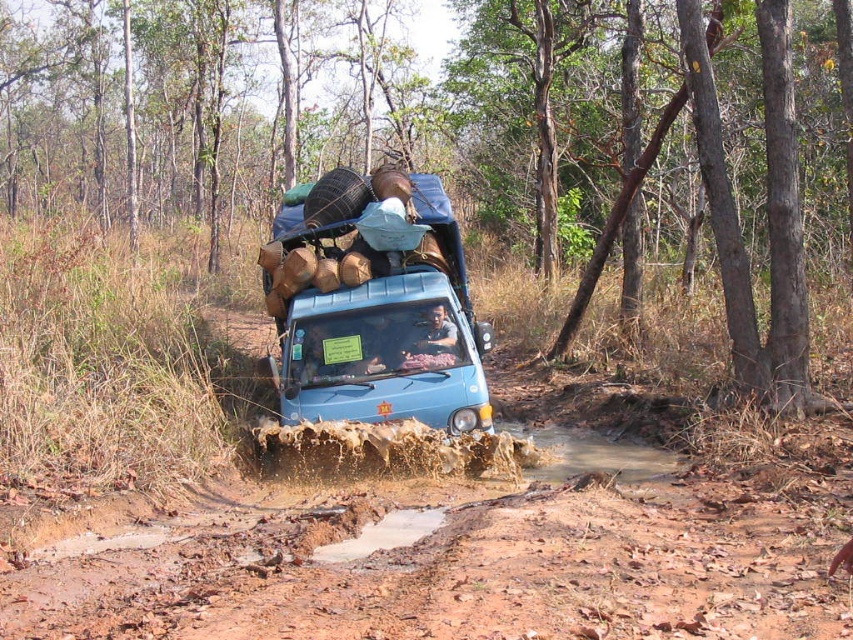
Question: Which of the following is the farthest from the observer?

Choices:
 (A) blue matte truck at center
 (B) brown muddy dirt track at center

Answer: (A)

Question: Can you confirm if brown muddy dirt track at center is bigger than blue matte truck at center?

Choices:
 (A) yes
 (B) no

Answer: (B)

Question: Is brown muddy dirt track at center wider than blue matte truck at center?

Choices:
 (A) no
 (B) yes

Answer: (B)

Question: Is brown muddy dirt track at center closer to camera compared to blue matte truck at center?

Choices:
 (A) no
 (B) yes

Answer: (B)

Question: Which point appears farthest from the camera in this image?

Choices:
 (A) (529, 634)
 (B) (335, 321)

Answer: (B)